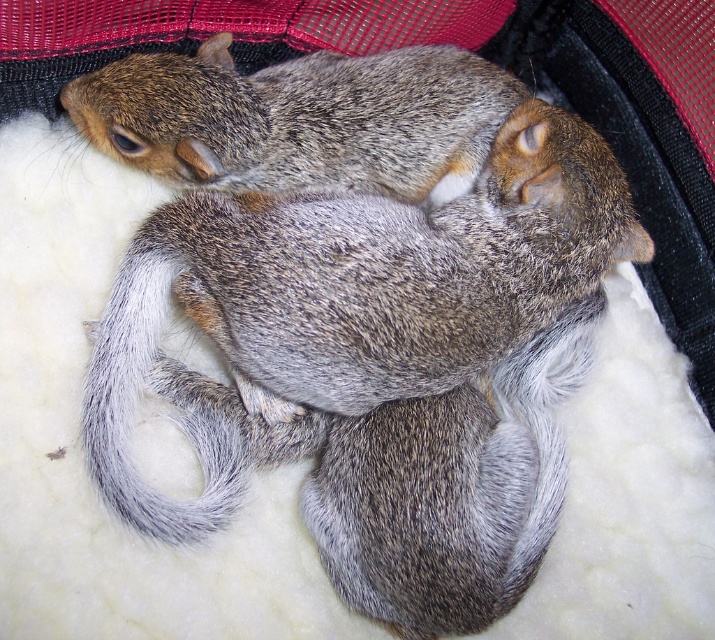
Question: In this image, where is gray-furred squirrel at upper center located relative to gray fuzzy tail at lower center?

Choices:
 (A) left
 (B) right

Answer: (B)

Question: Based on their relative distances, which object is nearer to the gray-furred squirrel at upper center?

Choices:
 (A) gray-furred squirrel at center
 (B) gray fuzzy tail at lower center

Answer: (A)

Question: Which point is farther from the camera taking this photo?

Choices:
 (A) (388, 353)
 (B) (429, 132)
 (C) (216, 515)

Answer: (B)

Question: Can you confirm if gray-furred squirrel at center is thinner than gray-furred squirrel at upper center?

Choices:
 (A) no
 (B) yes

Answer: (A)

Question: Among these objects, which one is nearest to the camera?

Choices:
 (A) gray-furred squirrel at center
 (B) gray fuzzy tail at lower center

Answer: (A)

Question: Can you confirm if gray-furred squirrel at center is positioned to the right of gray fuzzy tail at lower center?

Choices:
 (A) no
 (B) yes

Answer: (B)